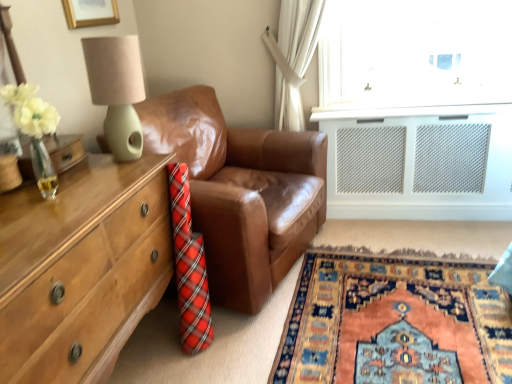
Question: Does brown leather couch at center have a lesser width compared to carpet with intricate patterns at lower right?

Choices:
 (A) yes
 (B) no

Answer: (A)

Question: Considering the relative sizes of brown leather couch at center and carpet with intricate patterns at lower right in the image provided, is brown leather couch at center taller than carpet with intricate patterns at lower right?

Choices:
 (A) yes
 (B) no

Answer: (A)

Question: Is brown leather couch at center to the left of carpet with intricate patterns at lower right from the viewer's perspective?

Choices:
 (A) yes
 (B) no

Answer: (A)

Question: Could you tell me if brown leather couch at center is facing carpet with intricate patterns at lower right?

Choices:
 (A) no
 (B) yes

Answer: (B)

Question: From a real-world perspective, is brown leather couch at center located beneath carpet with intricate patterns at lower right?

Choices:
 (A) yes
 (B) no

Answer: (B)

Question: Considering the positions of point (91, 62) and point (352, 329), is point (91, 62) closer or farther from the camera than point (352, 329)?

Choices:
 (A) farther
 (B) closer

Answer: (B)

Question: From the image's perspective, relative to carpet with intricate patterns at lower right, is matte green lamp at upper left above or below?

Choices:
 (A) above
 (B) below

Answer: (A)

Question: Considering their positions, is matte green lamp at upper left located in front of or behind carpet with intricate patterns at lower right?

Choices:
 (A) behind
 (B) front

Answer: (A)

Question: From a real-world perspective, is matte green lamp at upper left physically located above or below carpet with intricate patterns at lower right?

Choices:
 (A) below
 (B) above

Answer: (B)

Question: Is wooden chest of drawers at left wider or thinner than brown leather couch at center?

Choices:
 (A) thin
 (B) wide

Answer: (A)

Question: From the image's perspective, is wooden chest of drawers at left above or below brown leather couch at center?

Choices:
 (A) above
 (B) below

Answer: (B)

Question: Would you say wooden chest of drawers at left is inside or outside brown leather couch at center?

Choices:
 (A) outside
 (B) inside

Answer: (A)

Question: Considering the positions of point (70, 294) and point (306, 216), is point (70, 294) closer or farther from the camera than point (306, 216)?

Choices:
 (A) farther
 (B) closer

Answer: (B)

Question: From the image's perspective, is carpet with intricate patterns at lower right positioned above or below wooden chest of drawers at left?

Choices:
 (A) above
 (B) below

Answer: (B)

Question: In terms of height, does carpet with intricate patterns at lower right look taller or shorter compared to wooden chest of drawers at left?

Choices:
 (A) tall
 (B) short

Answer: (B)